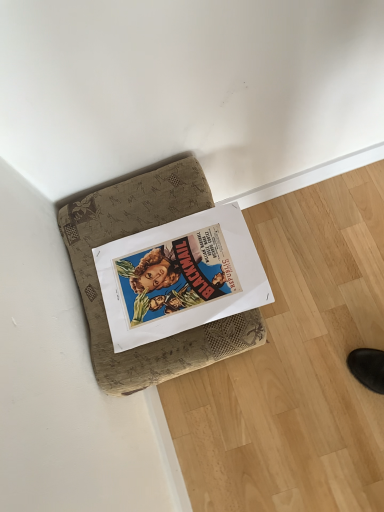
This screenshot has height=512, width=384. In order to click on free spot above brown fabric cushion at upper center (from a real-world perspective) in this screenshot , I will do `click(162, 260)`.